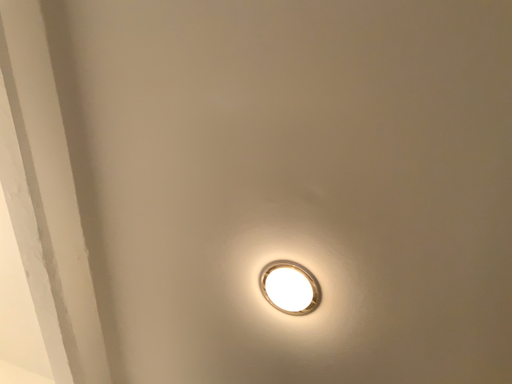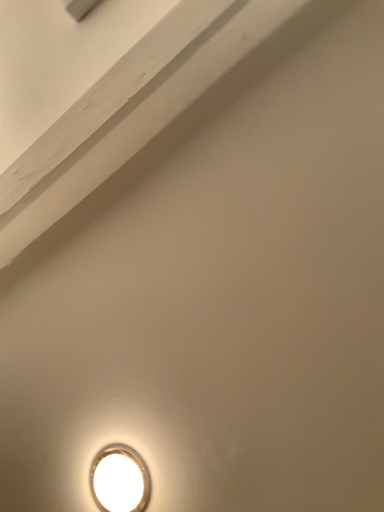
Question: Which way did the camera rotate in the video?

Choices:
 (A) rotated right
 (B) rotated left

Answer: (A)